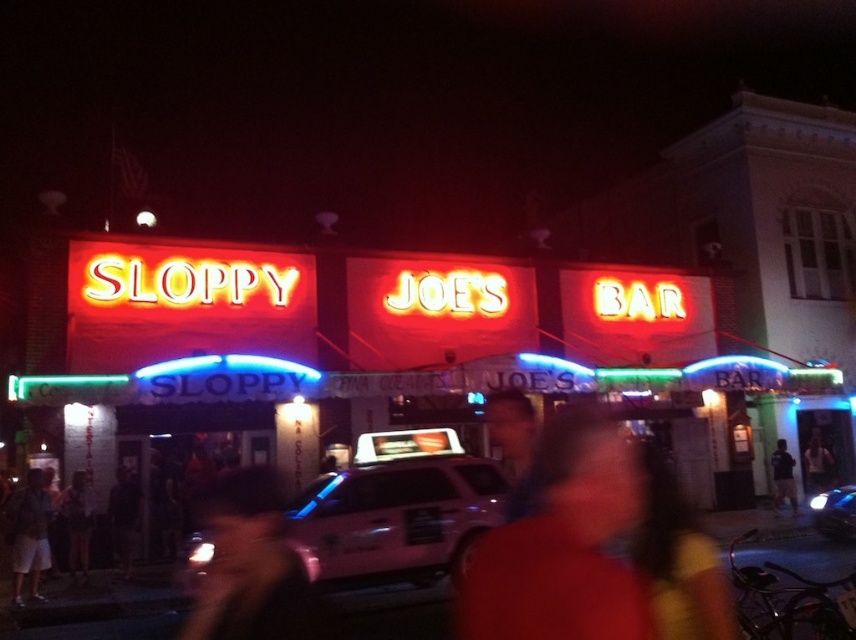
Question: Does white plastic car at center have a larger size compared to camouflage jacket at lower left?

Choices:
 (A) yes
 (B) no

Answer: (A)

Question: Can you confirm if red matte shirt at center is thinner than white glossy car at center?

Choices:
 (A) yes
 (B) no

Answer: (B)

Question: Considering the real-world distances, which object is farthest from the dark hair at lower left?

Choices:
 (A) white fabric shirt at center
 (B) red matte shirt at center
 (C) dark blue shirt at center
 (D) white plastic car at center

Answer: (A)

Question: Which object is the closest to the shiny black hat at lower left?

Choices:
 (A) white plastic car at center
 (B) red matte shirt at center
 (C) dark blue shirt at center
 (D) dark hair at center

Answer: (A)

Question: Can you confirm if shiny black hat at lower left is positioned above dark hair at lower left?

Choices:
 (A) no
 (B) yes

Answer: (A)

Question: Which object is farther from the camera taking this photo?

Choices:
 (A) white fabric shirt at center
 (B) dark hair at lower left
 (C) white glossy car at center

Answer: (A)